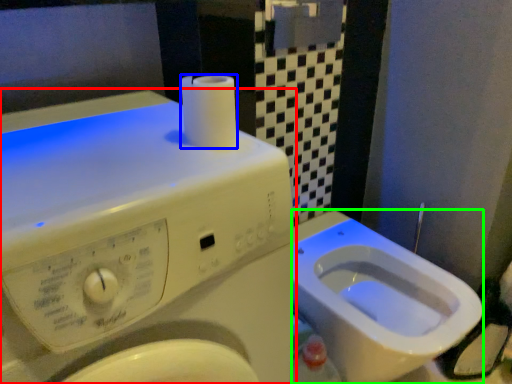
Question: Estimate the real-world distances between objects in this image. Which object is farther from washing machine (highlighted by a red box), toilet paper (highlighted by a blue box) or bidet (highlighted by a green box)?

Choices:
 (A) toilet paper
 (B) bidet

Answer: (B)